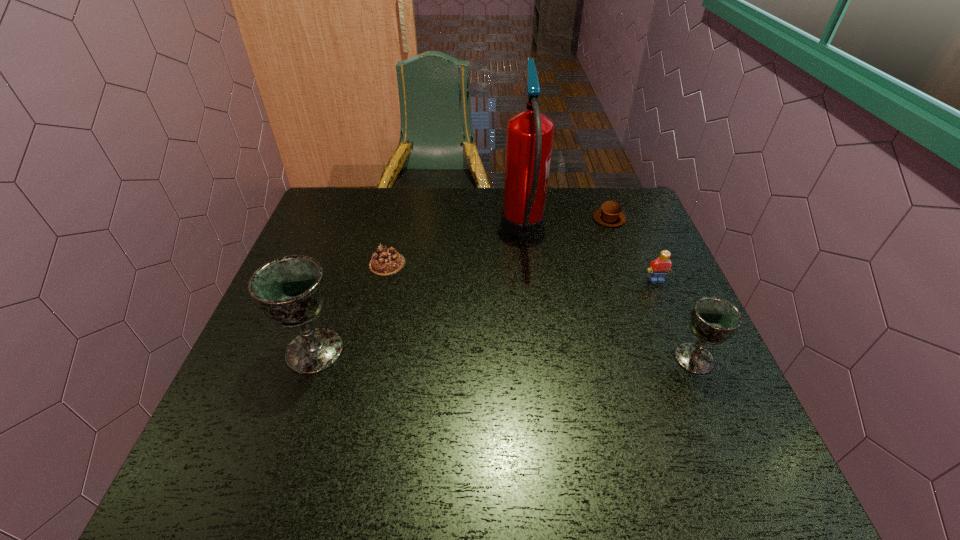
Where is `blank region between the fourth object from right to left and the right chalice`? blank region between the fourth object from right to left and the right chalice is located at coordinates (609, 294).

What are the coordinates of `vacant point located between the muffin and the fourth object from right to left` in the screenshot? It's located at (566, 225).

Locate an element on the screen. Image resolution: width=960 pixels, height=540 pixels. free point between the fifth tallest object and the shorter chalice is located at coordinates (652, 288).

You are a GUI agent. You are given a task and a screenshot of the screen. Output one action in this format:
    pyautogui.click(x=<x>, y=<y>)
    Task: Click on the free space between the Lego and the second tallest object
    This screenshot has width=960, height=540.
    Given the screenshot: What is the action you would take?
    pyautogui.click(x=486, y=315)

Locate an element on the screen. This screenshot has width=960, height=540. blank region between the muffin and the fourth shortest object is located at coordinates (652, 288).

Where is `vacant point located between the muffin and the chocolate cake`? Image resolution: width=960 pixels, height=540 pixels. vacant point located between the muffin and the chocolate cake is located at coordinates (498, 241).

At what (x,y) coordinates should I click in order to perform the action: click on free space between the taller chalice and the shortest object. Please return your answer as a coordinate pair (x, y). The image size is (960, 540). Looking at the image, I should click on (351, 307).

Locate an element on the screen. vacant area that lies between the shortest object and the tallest object is located at coordinates (456, 247).

At what (x,y) coordinates should I click in order to perform the action: click on unoccupied area between the chocolate cake and the right chalice. Please return your answer as a coordinate pair (x, y). Looking at the image, I should click on (540, 311).

Where is `object identified as the fifth closest to the fire extinguisher`? object identified as the fifth closest to the fire extinguisher is located at coordinates (291, 290).